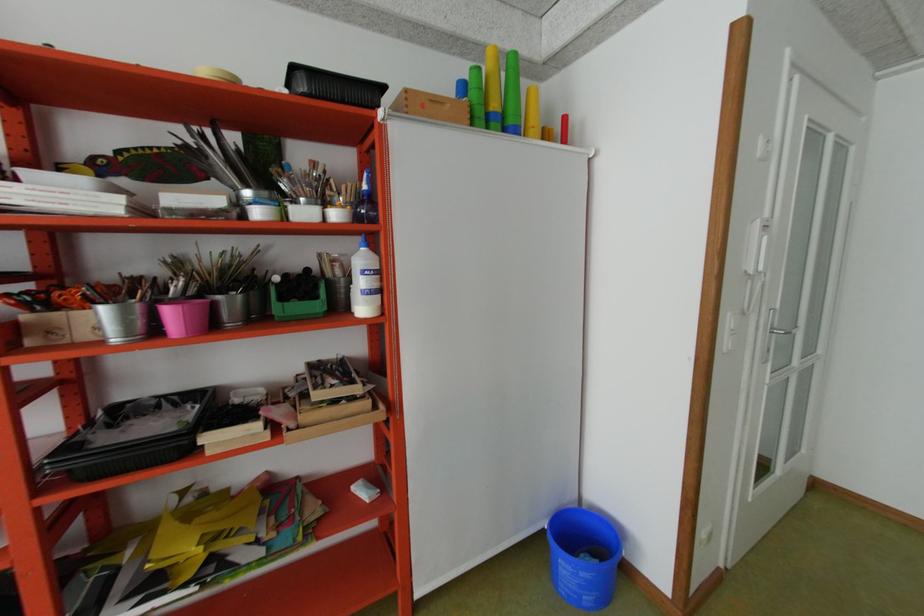
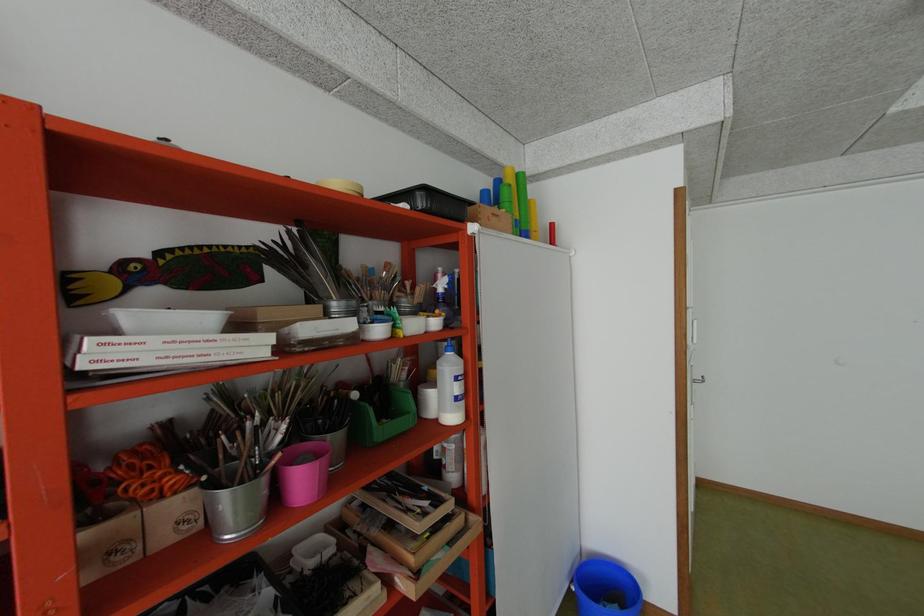
Question: The camera is either moving clockwise (left) or counter-clockwise (right) around the object. The first image is from the beginning of the video and the second image is from the end. Is the camera moving left or right when shooting the video?

Choices:
 (A) Left
 (B) Right

Answer: (A)